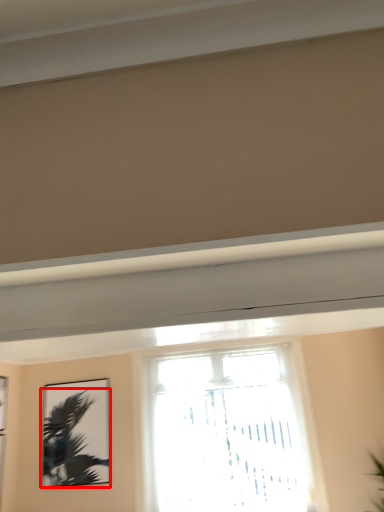
Question: From the image's perspective, what is the correct spatial positioning of palm tree (annotated by the red box) in reference to window?

Choices:
 (A) below
 (B) above

Answer: (A)